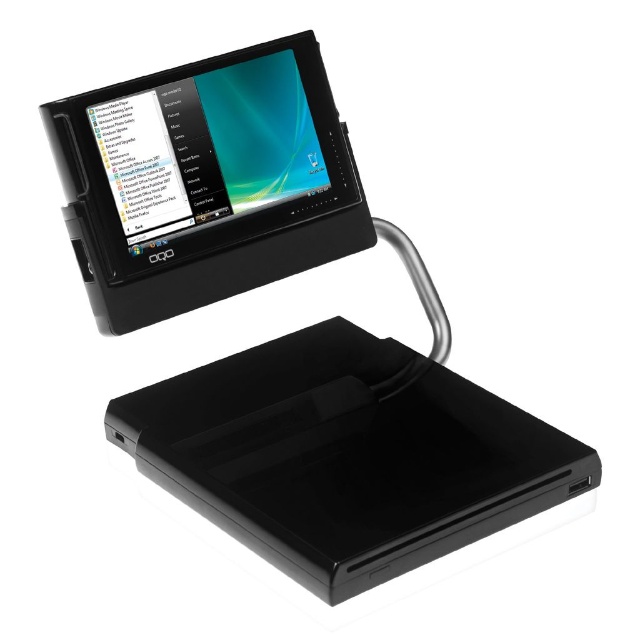
Question: Which of the following is the farthest from the observer?

Choices:
 (A) (131, 417)
 (B) (198, 273)

Answer: (B)

Question: Is black glossy ipod at lower center wider than matte black tablet at upper left?

Choices:
 (A) yes
 (B) no

Answer: (A)

Question: Can you confirm if black glossy ipod at lower center is smaller than matte black tablet at upper left?

Choices:
 (A) no
 (B) yes

Answer: (A)

Question: Does black glossy ipod at lower center have a larger size compared to matte black tablet at upper left?

Choices:
 (A) yes
 (B) no

Answer: (A)

Question: Among these objects, which one is farthest from the camera?

Choices:
 (A) matte black tablet at upper left
 (B) black glossy ipod at lower center

Answer: (A)

Question: Which point appears closest to the camera in this image?

Choices:
 (A) (289, 362)
 (B) (125, 301)

Answer: (B)